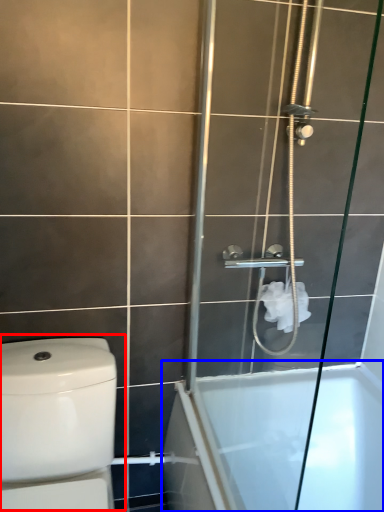
Question: Which object appears closest to the camera in this image, toilet (highlighted by a red box) or bathtub (highlighted by a blue box)?

Choices:
 (A) toilet
 (B) bathtub

Answer: (A)